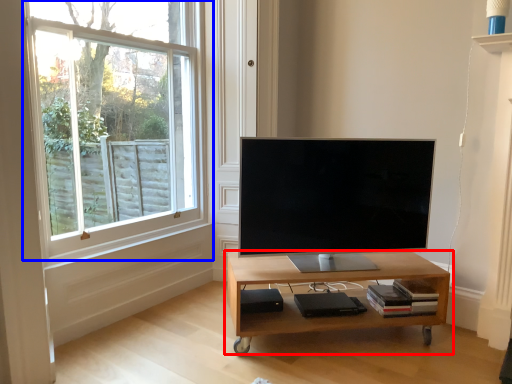
Question: Among these objects, which one is nearest to the camera, table (highlighted by a red box) or window (highlighted by a blue box)?

Choices:
 (A) table
 (B) window

Answer: (B)